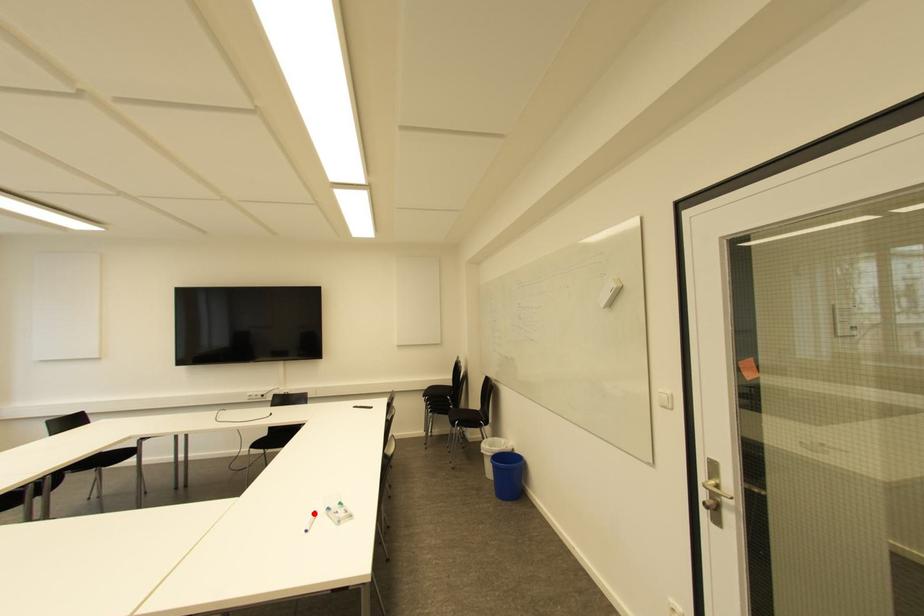
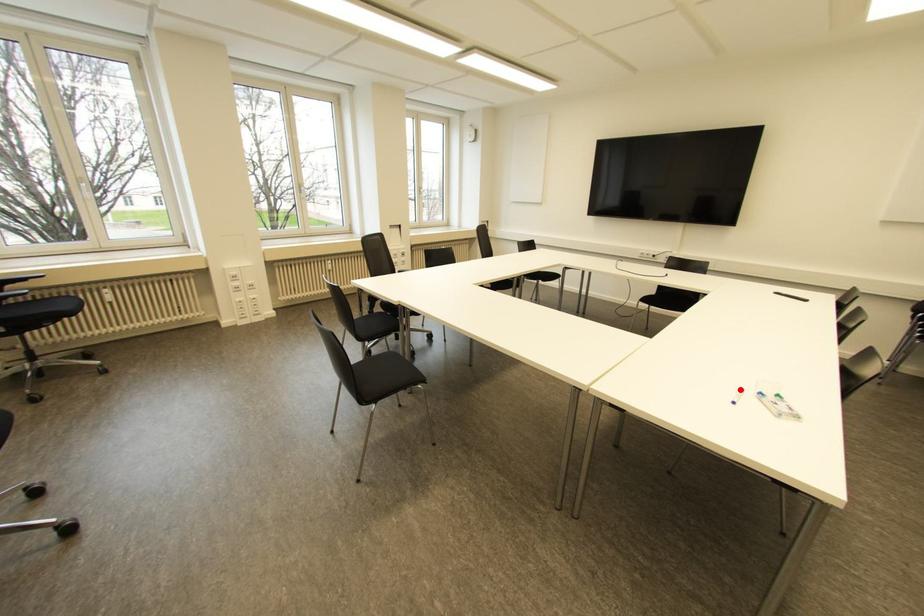
I am providing you with two images of the same scene from different viewpoints. A red point is marked on the first image and another point is marked on the second image. Is the marked point in image1 the same physical position as the marked point in image2?

Yes